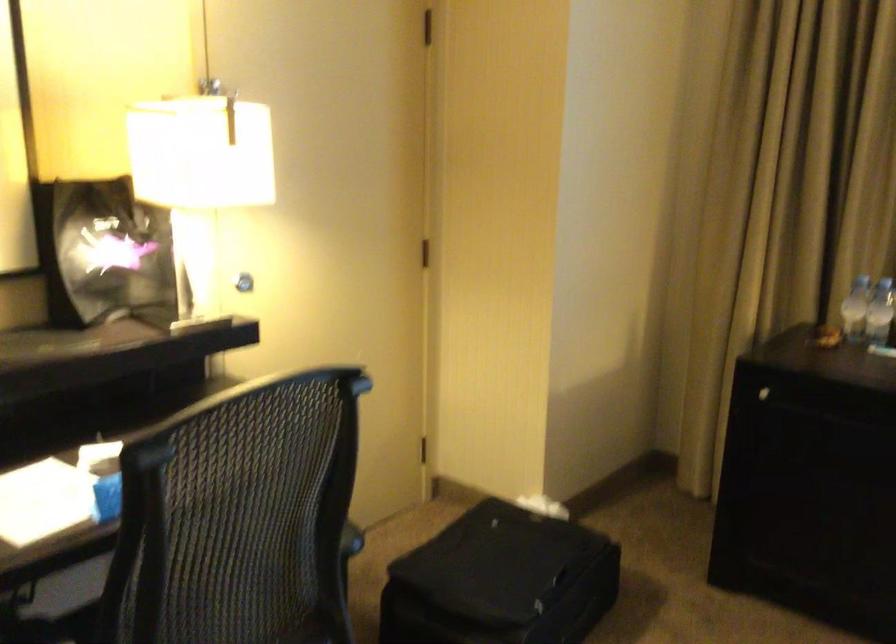
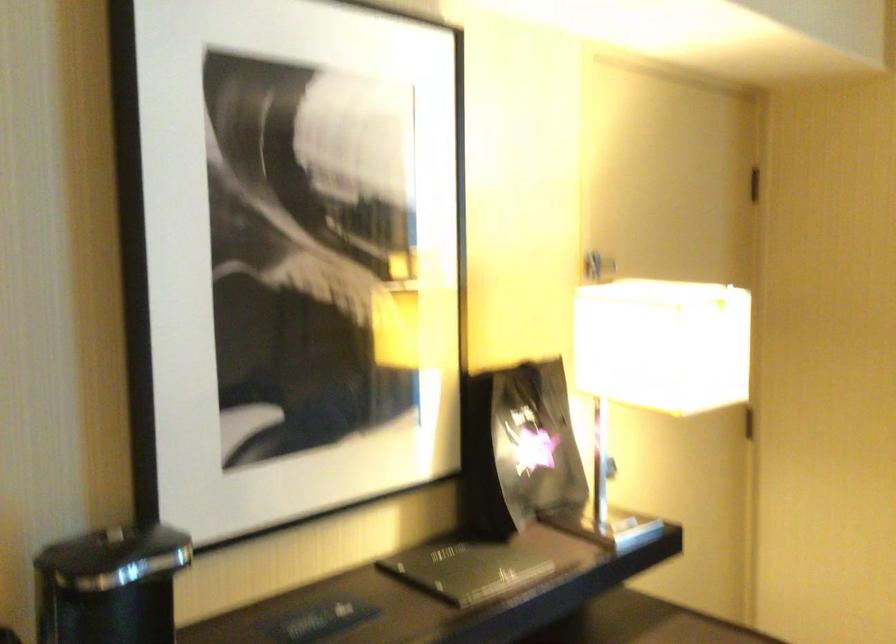
Question: Based on the continuous images, in which direction is the camera rotating? Reply with the corresponding letter.

Choices:
 (A) Left
 (B) Right
 (C) Up
 (D) Down

Answer: (C)